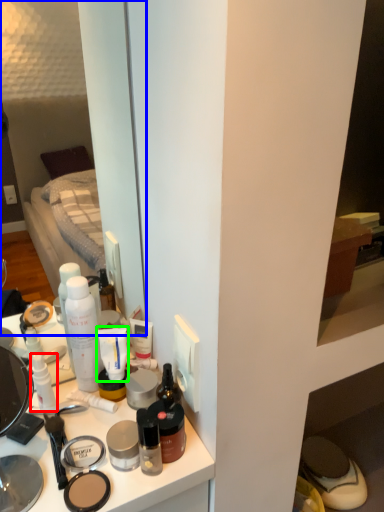
Question: Considering the real-world distances, which object is closest to toiletry (highlighted by a red box)? mirror (highlighted by a blue box) or toothpaste (highlighted by a green box).

Choices:
 (A) mirror
 (B) toothpaste

Answer: (B)